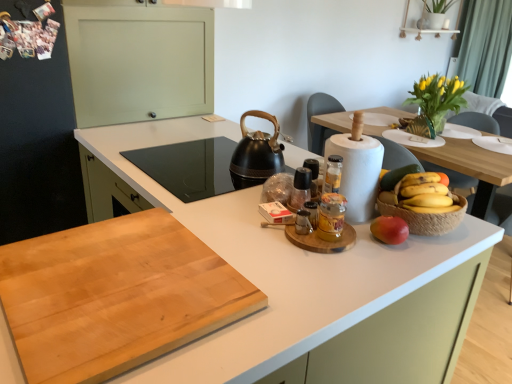
You are a GUI agent. You are given a task and a screenshot of the screen. Output one action in this format:
    pyautogui.click(x=<x>, y=<y>)
    Task: Click on the vacant space to the left of black rubberized kettle at center
    The width and height of the screenshot is (512, 384).
    Given the screenshot: What is the action you would take?
    pyautogui.click(x=202, y=163)